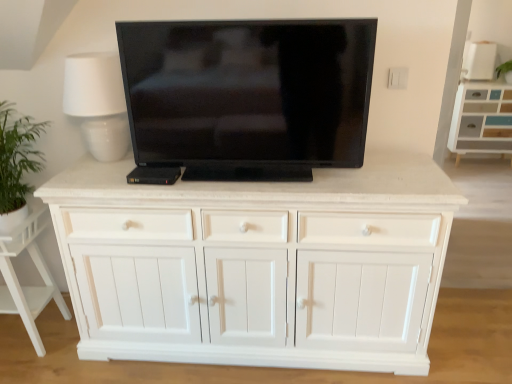
Question: Does white ceramic table lamp at upper left appear on the right side of white wood cabinet at upper right?

Choices:
 (A) yes
 (B) no

Answer: (B)

Question: Is white ceramic table lamp at upper left thinner than white wood cabinet at upper right?

Choices:
 (A) yes
 (B) no

Answer: (A)

Question: From a real-world perspective, is white ceramic table lamp at upper left beneath white wood cabinet at upper right?

Choices:
 (A) yes
 (B) no

Answer: (B)

Question: From the image's perspective, would you say white ceramic table lamp at upper left is shown under white wood cabinet at upper right?

Choices:
 (A) no
 (B) yes

Answer: (B)

Question: Can you confirm if white ceramic table lamp at upper left is shorter than white wood cabinet at upper right?

Choices:
 (A) no
 (B) yes

Answer: (B)

Question: Considering the relative positions of black glossy tv at center and white wood cabinet at lower left in the image provided, is black glossy tv at center to the left or to the right of white wood cabinet at lower left?

Choices:
 (A) left
 (B) right

Answer: (B)

Question: From the image's perspective, is black glossy tv at center located above or below white wood cabinet at lower left?

Choices:
 (A) below
 (B) above

Answer: (B)

Question: Based on their sizes in the image, would you say black glossy tv at center is bigger or smaller than white wood cabinet at lower left?

Choices:
 (A) small
 (B) big

Answer: (A)

Question: Is black glossy tv at center in front of or behind white wood cabinet at lower left in the image?

Choices:
 (A) behind
 (B) front

Answer: (B)

Question: In the image, is white wood cabinet at upper right positioned in front of or behind white ceramic table lamp at upper left?

Choices:
 (A) behind
 (B) front

Answer: (A)

Question: Considering the positions of point (493, 92) and point (92, 57), is point (493, 92) closer or farther from the camera than point (92, 57)?

Choices:
 (A) farther
 (B) closer

Answer: (A)

Question: From the image's perspective, is white wood cabinet at upper right located above or below white ceramic table lamp at upper left?

Choices:
 (A) above
 (B) below

Answer: (A)

Question: In terms of size, does white wood cabinet at upper right appear bigger or smaller than white ceramic table lamp at upper left?

Choices:
 (A) small
 (B) big

Answer: (B)

Question: Based on their sizes in the image, would you say white wood cabinet at lower left is bigger or smaller than black glossy tv at center?

Choices:
 (A) small
 (B) big

Answer: (B)

Question: Is white wood cabinet at lower left wider or thinner than black glossy tv at center?

Choices:
 (A) wide
 (B) thin

Answer: (A)